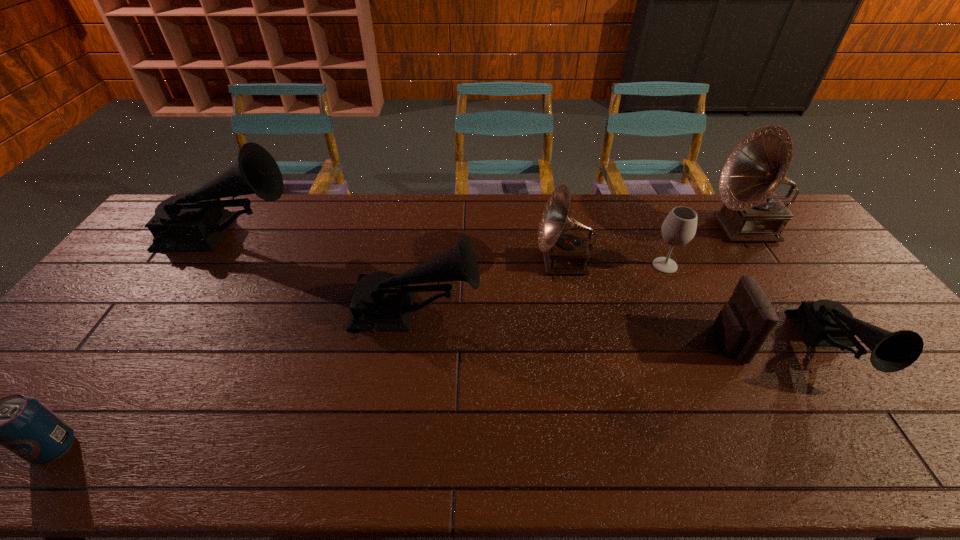
The width and height of the screenshot is (960, 540). Identify the location of the right brown phonograph record. (752, 212).

This screenshot has width=960, height=540. What are the coordinates of `the biggest black phonograph_record` in the screenshot? It's located at (195, 221).

You are a GUI agent. You are given a task and a screenshot of the screen. Output one action in this format:
    pyautogui.click(x=<x>, y=<y>)
    Task: Click on the leftmost black phonograph_record
    
    Given the screenshot: What is the action you would take?
    pyautogui.click(x=195, y=221)

The width and height of the screenshot is (960, 540). I want to click on the smaller brown phonograph record, so click(x=563, y=253).

Identify the location of the fifth object from right to left. The height and width of the screenshot is (540, 960). (563, 253).

Image resolution: width=960 pixels, height=540 pixels. In order to click on the second smallest black phonograph_record in this screenshot , I will do `click(382, 301)`.

You are a GUI agent. You are given a task and a screenshot of the screen. Output one action in this format:
    pyautogui.click(x=<x>, y=<y>)
    Task: Click on the fourth phonograph_record from right to left
    
    Given the screenshot: What is the action you would take?
    pyautogui.click(x=382, y=301)

Where is `wineglass`? The height and width of the screenshot is (540, 960). wineglass is located at coordinates (679, 227).

At what (x,y) coordinates should I click in order to perform the action: click on the smallest black phonograph_record. Please return your answer as a coordinate pair (x, y). The height and width of the screenshot is (540, 960). Looking at the image, I should click on (823, 322).

At what (x,y) coordinates should I click in order to perform the action: click on the rightmost black phonograph_record. Please return your answer as a coordinate pair (x, y). This screenshot has height=540, width=960. Looking at the image, I should click on [x=823, y=322].